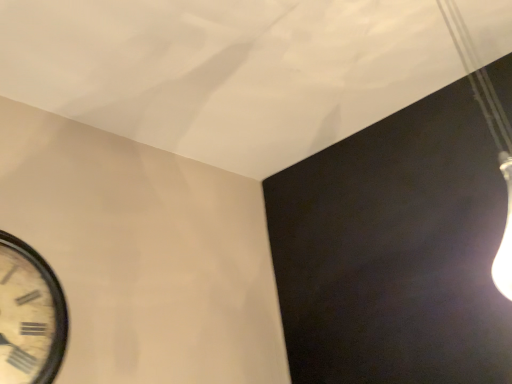
The width and height of the screenshot is (512, 384). What do you see at coordinates (29, 315) in the screenshot?
I see `white wooden clock at lower left` at bounding box center [29, 315].

Find the location of a particular element. white wooden clock at lower left is located at coordinates (29, 315).

Measure the distance between point (x=8, y=355) and camera.

Point (x=8, y=355) is 3.62 feet from camera.

Where is `white wooden clock at lower left`? white wooden clock at lower left is located at coordinates (29, 315).